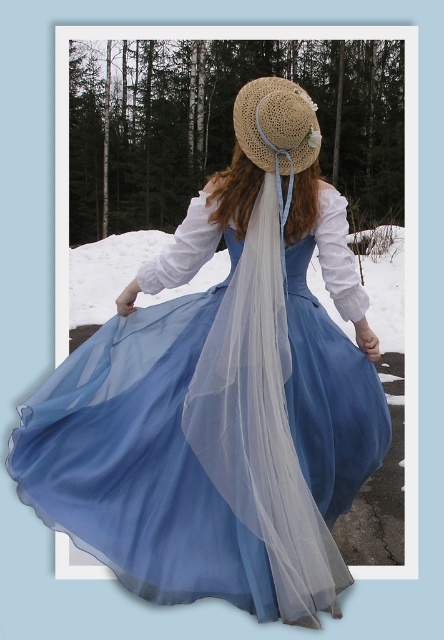
Question: Does light blue chiffon dress at center come in front of straw hat at center?

Choices:
 (A) yes
 (B) no

Answer: (A)

Question: Which object is farther from the camera taking this photo?

Choices:
 (A) light blue chiffon dress at center
 (B) straw hat at center

Answer: (B)

Question: From the image, what is the correct spatial relationship of light blue chiffon dress at center in relation to straw hat at center?

Choices:
 (A) right
 (B) left

Answer: (B)

Question: Among these points, which one is farthest from the camera?

Choices:
 (A) (213, 570)
 (B) (258, 144)

Answer: (B)

Question: Does light blue chiffon dress at center come in front of straw hat at center?

Choices:
 (A) yes
 (B) no

Answer: (A)

Question: Among these objects, which one is nearest to the camera?

Choices:
 (A) straw hat at center
 (B) light blue chiffon dress at center

Answer: (B)